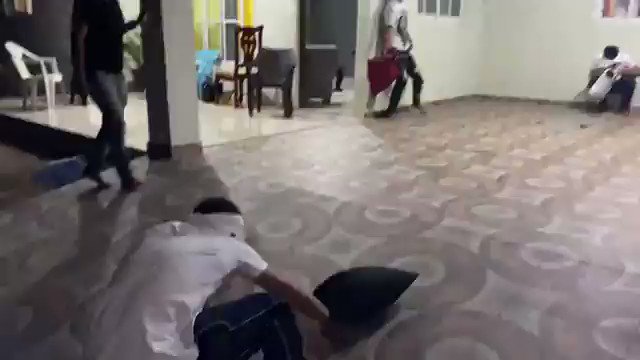
In order to click on chair in this screenshot , I will do `click(42, 81)`, `click(241, 73)`.